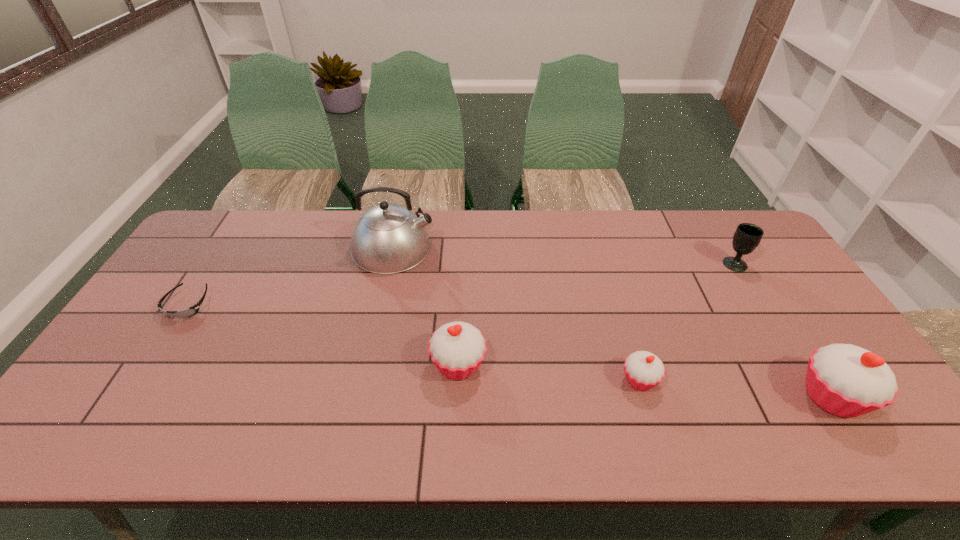
Locate an element on the screen. This screenshot has height=540, width=960. the leftmost cupcake is located at coordinates (457, 349).

Identify the location of the second shortest cupcake. The image size is (960, 540). (457, 349).

You are a GUI agent. You are given a task and a screenshot of the screen. Output one action in this format:
    pyautogui.click(x=<x>, y=<y>)
    Task: Click on the fifth tallest object
    
    Given the screenshot: What is the action you would take?
    pyautogui.click(x=644, y=370)

Locate an element on the screen. The width and height of the screenshot is (960, 540). the shortest cupcake is located at coordinates (644, 370).

Where is `the rightmost cupcake`? The image size is (960, 540). the rightmost cupcake is located at coordinates (846, 380).

This screenshot has height=540, width=960. In order to click on the leftmost object in this screenshot , I will do `click(191, 311)`.

The width and height of the screenshot is (960, 540). Identify the location of the third farthest object. (191, 311).

Identify the location of the tallest object. (388, 238).

Find the location of a particular element. The height and width of the screenshot is (540, 960). kettle is located at coordinates pos(388,238).

Identify the location of chalice. (747, 237).